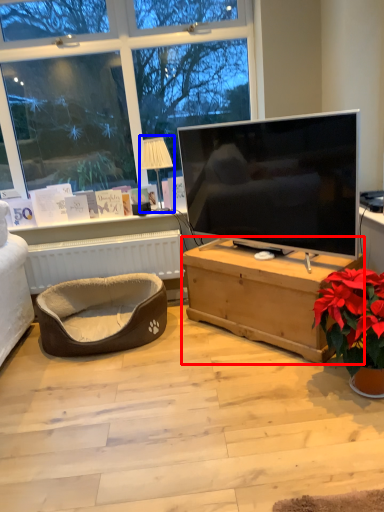
Question: Among these objects, which one is farthest to the camera, desk (highlighted by a red box) or lamp (highlighted by a blue box)?

Choices:
 (A) desk
 (B) lamp

Answer: (B)